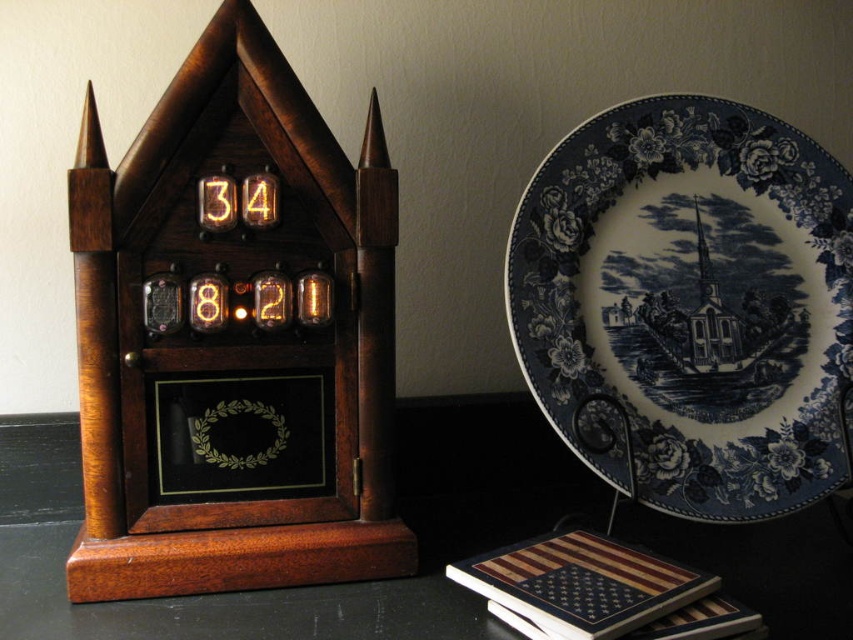
Question: Estimate the real-world distances between objects in this image. Which object is closer to the wooden table at center?

Choices:
 (A) polished wood clock at center
 (B) wooden american flag at lower right
 (C) blue ceramic plate at upper right

Answer: (B)

Question: Among these objects, which one is farthest from the camera?

Choices:
 (A) wooden table at center
 (B) blue ceramic plate at upper right
 (C) polished wood clock at center

Answer: (B)

Question: Does polished wood clock at center appear on the right side of wooden table at center?

Choices:
 (A) no
 (B) yes

Answer: (A)

Question: Does polished wood clock at center lie in front of wooden american flag at lower right?

Choices:
 (A) no
 (B) yes

Answer: (A)

Question: Does polished wood clock at center have a larger size compared to blue ceramic plate at upper right?

Choices:
 (A) yes
 (B) no

Answer: (B)

Question: Which of the following is the closest to the observer?

Choices:
 (A) (222, 422)
 (B) (846, 612)

Answer: (B)